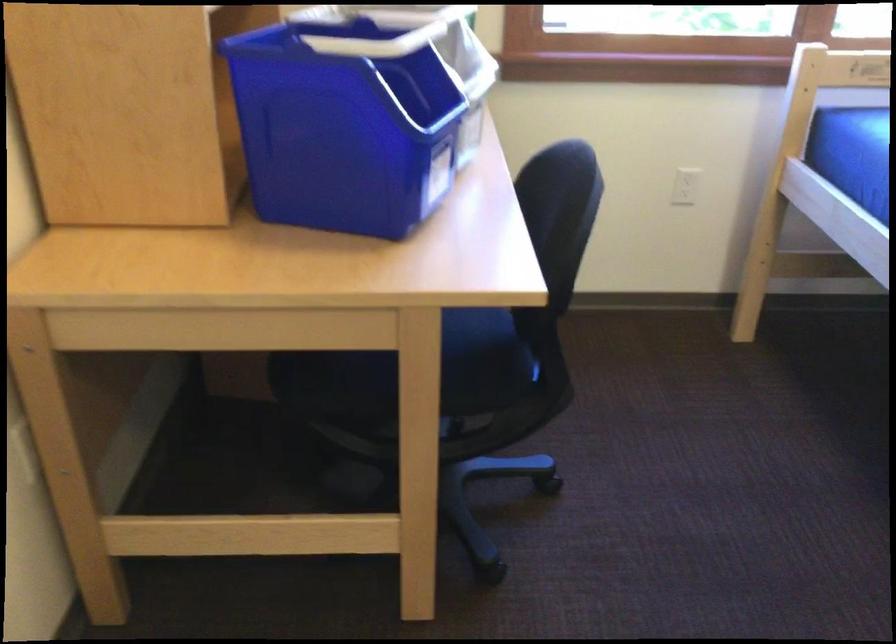
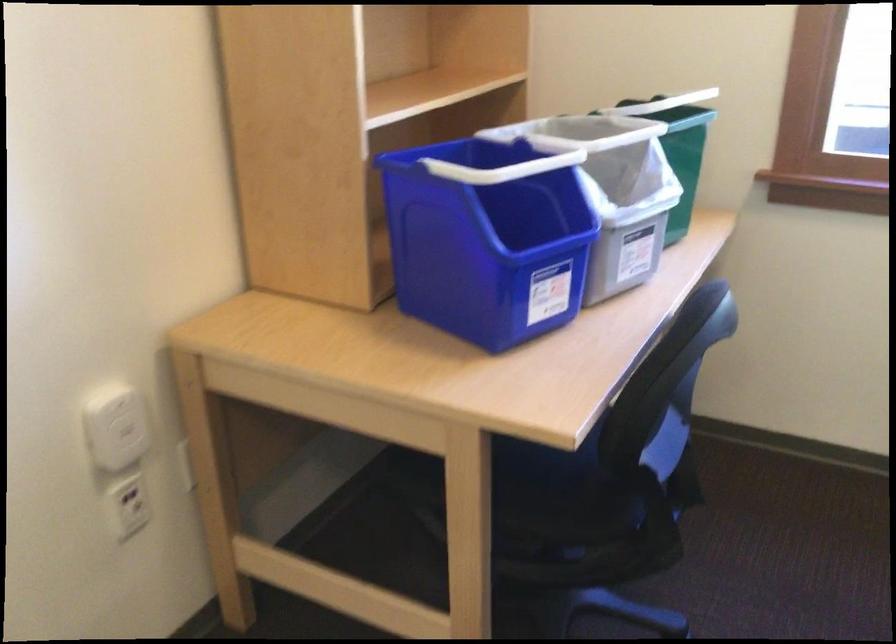
Question: The camera is either moving clockwise (left) or counter-clockwise (right) around the object. The first image is from the beginning of the video and the second image is from the end. Is the camera moving left or right when shooting the video?

Choices:
 (A) Left
 (B) Right

Answer: (B)